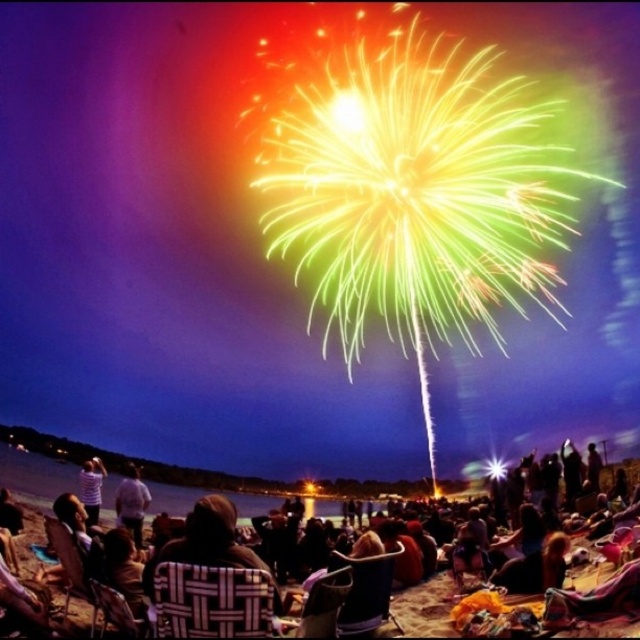
You are a photographer at the beach fireworks display. You want to take a photo of the crowd while ensuring both the white cotton shirt at lower left and the striped shirt at lower left are visible. Which shirt should you focus on to make sure both are in the frame?

The white cotton shirt at lower left is below the striped shirt at lower left, so focusing on the striped shirt at lower left will ensure both shirts are visible in the frame.

You are a photographer trying to capture a photo of the fireworks display. You notice two items in the foreground that might obstruct your view. The items are the dark brown leather jacket at center and the striped shirt at lower left. Which item is bigger and might block more of your camera lens?

The dark brown leather jacket at center is larger in size than the striped shirt at lower left, so it might block more of your camera lens.